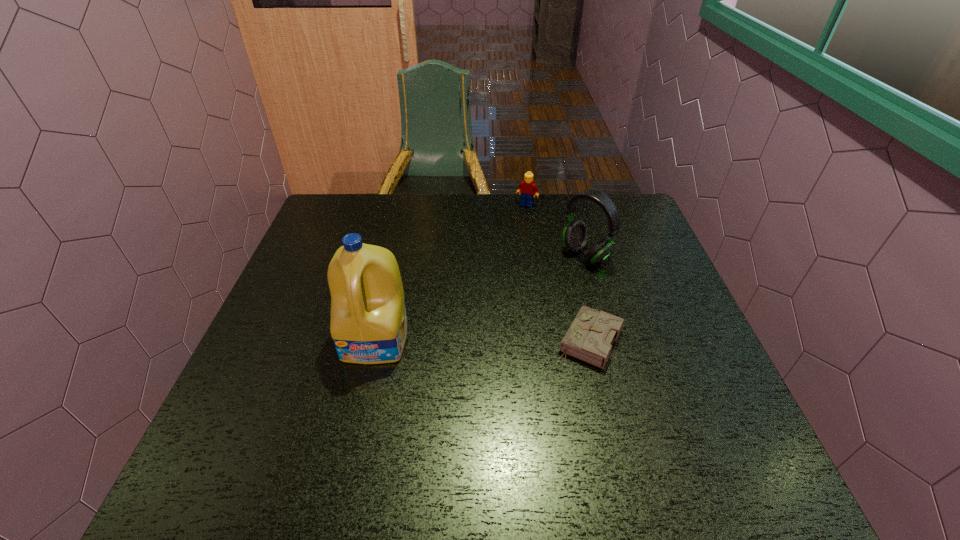
Image resolution: width=960 pixels, height=540 pixels. I want to click on free space at the right edge of the desktop, so click(621, 285).

This screenshot has height=540, width=960. What are the coordinates of `vacant space at the far left corner of the desktop` in the screenshot? It's located at (343, 200).

This screenshot has width=960, height=540. I want to click on vacant space at the near left corner of the desktop, so click(x=249, y=411).

The width and height of the screenshot is (960, 540). Find the location of `free space at the near right corner`. free space at the near right corner is located at coordinates (745, 433).

The width and height of the screenshot is (960, 540). In order to click on vacant area that lies between the second tallest object and the diary in this screenshot , I will do `click(588, 298)`.

Image resolution: width=960 pixels, height=540 pixels. What are the coordinates of `free space between the shortest object and the detergent` in the screenshot? It's located at (483, 340).

Find the location of a particular element. The height and width of the screenshot is (540, 960). free area in between the farthest object and the detergent is located at coordinates (451, 272).

At what (x,y) coordinates should I click in order to perform the action: click on vacant area that lies between the leftmost object and the shortest object. Please return your answer as a coordinate pair (x, y). Looking at the image, I should click on click(483, 340).

Image resolution: width=960 pixels, height=540 pixels. I want to click on free point between the detergent and the shortest object, so click(x=483, y=340).

Identify the location of unoccupied area between the shortest object and the headset. (588, 298).